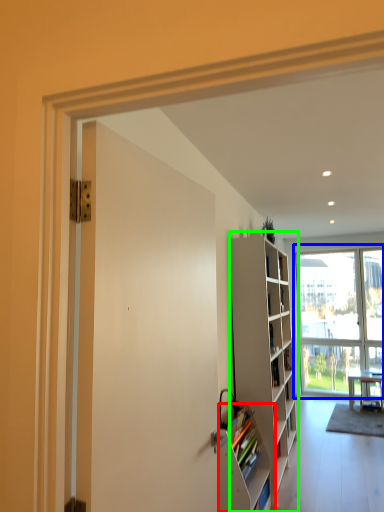
Question: Which object is positioned farthest from shelf (highlighted by a red box)? Select from window (highlighted by a blue box) and cabinetry (highlighted by a green box).

Choices:
 (A) window
 (B) cabinetry

Answer: (A)